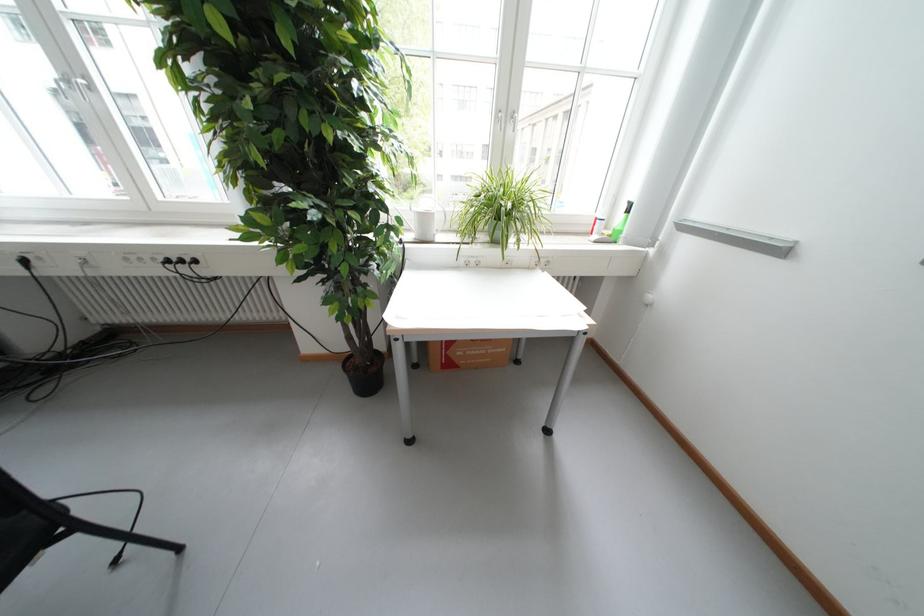
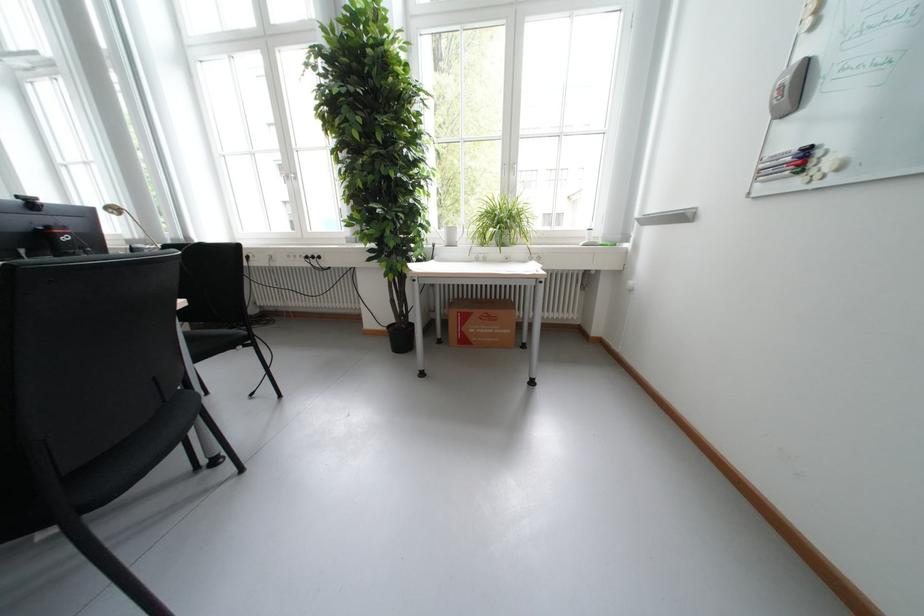
Where in the second image is the point corresponding to [458,366] from the first image?

(475, 342)